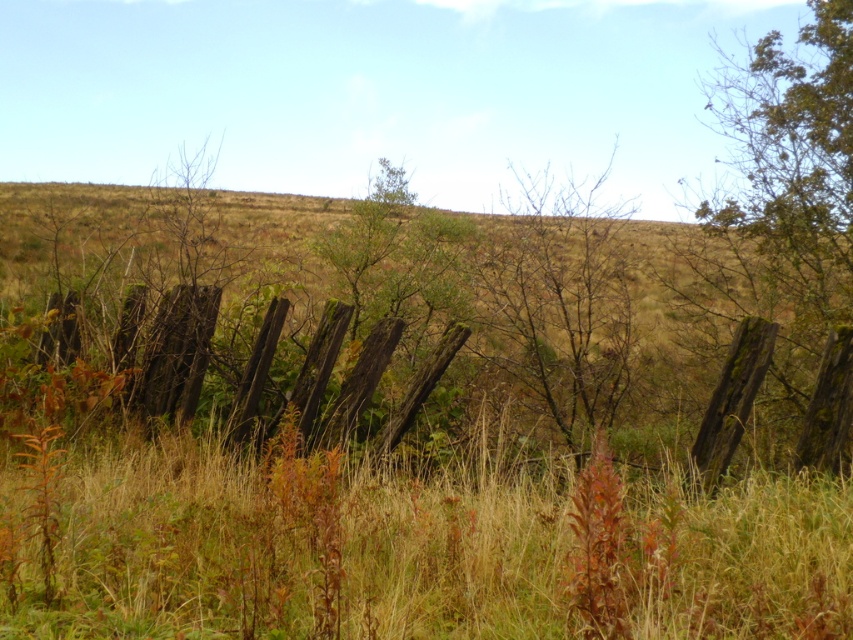
You are standing in a rural landscape and want to take a photo of the weathered wood fence at center. If your camera can focus on objects up to 20 feet away, will you need to move closer or farther away to get the fence in focus?

The weathered wood fence at center is 21.77 feet away from the camera, which is beyond the camera focus limit of 20 feet. Therefore, you need to move closer to the fence to bring it within the focus range.

You are a painter standing at the edge of the field of dry grass and wildflowers. You want to paint the weathered wood fence at center and the bare branches at center. If your paintbrush can reach up to 4 meters, can you paint both without moving your position?

The distance between the weathered wood fence at center and the bare branches at center is 3.94 meters, so yes, you can paint both without moving your position since the distance is within your paintbrush reach of 4 meters.